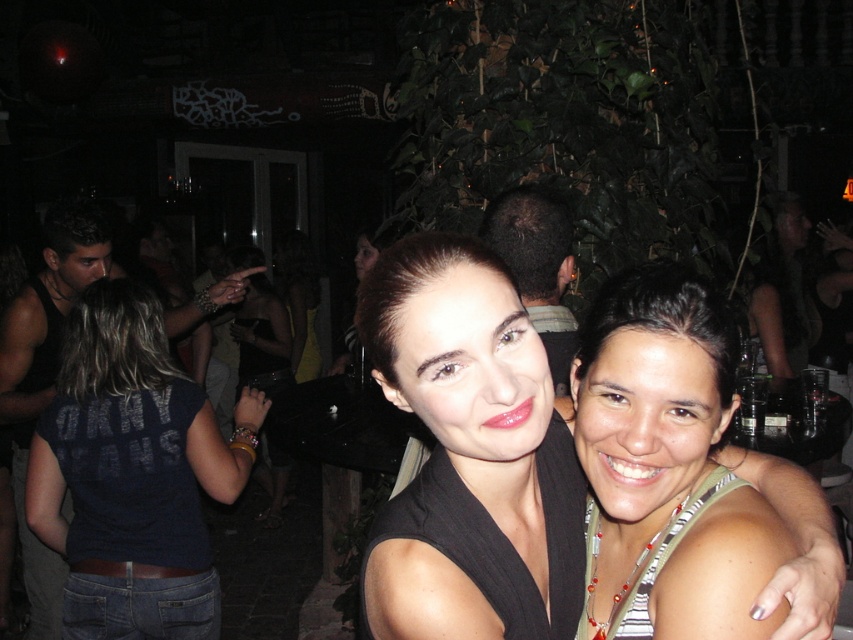
You are planning to take a photo of the two women in the scene. Since you want to ensure both the matte black top at center and the green striped tank top at center are clearly visible in the frame, which one should you focus on first to get the best depth of field?

The matte black top at center is taller than the green striped tank top at center, so focusing on the matte black top at center first will ensure both are in focus due to its greater distance from the camera.

You are a photographer at the event and need to ensure both the matte black top at center and the green striped tank top at center are visible in your photo. Since the camera can only focus on one subject at a time, which top should you focus on to ensure the other is still in the frame?

The matte black top at center is wider than the green striped tank top at center, so focusing on the wider matte black top at center will ensure the narrower green striped tank top at center remains in the frame.

You are attending a party and notice two items in the scene. One is the matte black top at center and the other is the denim jeans at lower left. Which item is smaller in size?

The matte black top at center is smaller in size compared to the denim jeans at lower left.